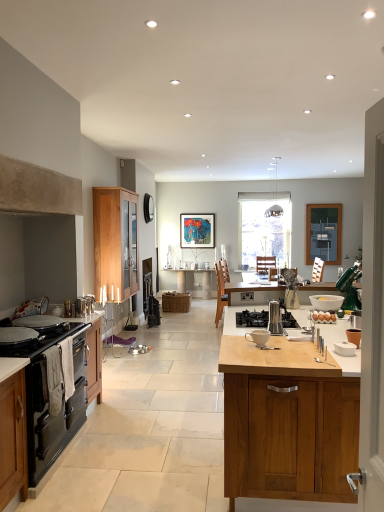
What do you see at coordinates (252, 319) in the screenshot? I see `stainless steel gas stove at center, the 1th gas stove viewed from the right` at bounding box center [252, 319].

This screenshot has height=512, width=384. What are the coordinates of `black matte stove at left` in the screenshot? It's located at (17, 335).

Locate an element on the screen. wooden cabinet at right, which is the first cabinetry from right to left is located at coordinates (287, 421).

Based on the photo, measure the distance between point (353, 295) and camera.

4.14 meters.

From the picture: What is the approximate width of black matte oven at left, which is the 1th appliance in left-to-right order?

It is 16.49 inches.

The image size is (384, 512). Identify the location of black plastic phone at upper center. [148, 208].

Would you consider wooden cabinet at right, which is the first cabinetry from right to left, to be distant from satin silver coffee maker at center, acting as the second appliance starting from the right?

That's right, there is a large distance between wooden cabinet at right, which is the first cabinetry from right to left, and satin silver coffee maker at center, acting as the second appliance starting from the right.

Which of these two, wooden cabinet at right, placed as the third cabinetry when sorted from left to right, or satin silver coffee maker at center, the first appliance in the back-to-front sequence, is bigger?

Bigger between the two is wooden cabinet at right, placed as the third cabinetry when sorted from left to right.

Which of these two, wooden cabinet at right, placed as the 1th cabinetry when sorted from front to back, or satin silver coffee maker at center, the first appliance in the back-to-front sequence, is thinner?

satin silver coffee maker at center, the first appliance in the back-to-front sequence, is thinner.

Who is shorter, wooden cabinet at right, the third cabinetry from the back, or satin silver coffee maker at center, the fifth appliance viewed from the left?

satin silver coffee maker at center, the fifth appliance viewed from the left, is shorter.

Between wooden cabinet at left, marked as the 2th cabinetry in a right-to-left arrangement, and satin nickel faucet at center, the 4th appliance from the right, which one is positioned behind?

wooden cabinet at left, marked as the 2th cabinetry in a right-to-left arrangement, is behind.

In the image, is wooden cabinet at left, acting as the second cabinetry starting from the left, on the left side or the right side of satin nickel faucet at center, the 4th appliance positioned from the front?

Based on their positions, wooden cabinet at left, acting as the second cabinetry starting from the left, is located to the left of satin nickel faucet at center, the 4th appliance positioned from the front.

Is wooden cabinet at left, marked as the 2th cabinetry in a right-to-left arrangement, beside satin nickel faucet at center, the 4th appliance positioned from the front?

No, wooden cabinet at left, marked as the 2th cabinetry in a right-to-left arrangement, is not making contact with satin nickel faucet at center, the 4th appliance positioned from the front.

Which object is thinner, wooden cabinet at left, which is counted as the 3th cabinetry, starting from the front, or satin nickel faucet at center, placed as the 3th appliance when sorted from left to right?

satin nickel faucet at center, placed as the 3th appliance when sorted from left to right.

The width and height of the screenshot is (384, 512). There is a stainless steel gas stove at center, the 2th gas stove from the left. In order to click on the 6th appliance above it (from the image's perspective) in this screenshot , I will do `click(290, 289)`.

Considering the positions of objects stainless steel gas stove at center, the 1th gas stove viewed from the right, and satin silver coffee maker at center, which is counted as the sixth appliance, starting from the front, in the image provided, who is behind, stainless steel gas stove at center, the 1th gas stove viewed from the right, or satin silver coffee maker at center, which is counted as the sixth appliance, starting from the front,?

Positioned behind is satin silver coffee maker at center, which is counted as the sixth appliance, starting from the front.

How far apart are stainless steel gas stove at center, the 1th gas stove viewed from the right, and satin silver coffee maker at center, the first appliance in the back-to-front sequence?

stainless steel gas stove at center, the 1th gas stove viewed from the right, and satin silver coffee maker at center, the first appliance in the back-to-front sequence, are 53.83 centimeters apart.

Can you confirm if stainless steel gas stove at center, the 2th gas stove from the left, is taller than satin silver coffee maker at center, the first appliance in the back-to-front sequence?

In fact, stainless steel gas stove at center, the 2th gas stove from the left, may be shorter than satin silver coffee maker at center, the first appliance in the back-to-front sequence.

Based on the photo, between white ceramic cup at center and green metallic stand mixer at right, which is the 2th appliance in back-to-front order, which one has larger size?

green metallic stand mixer at right, which is the 2th appliance in back-to-front order.

From a real-world perspective, is white ceramic cup at center positioned under green metallic stand mixer at right, which is the 2th appliance in back-to-front order, based on gravity?

Yes, from a real-world perspective, white ceramic cup at center is under green metallic stand mixer at right, which is the 2th appliance in back-to-front order.

Is white ceramic cup at center facing away from green metallic stand mixer at right, which is the 2th appliance in back-to-front order?

No, white ceramic cup at center is not facing the opposite direction of green metallic stand mixer at right, which is the 2th appliance in back-to-front order.

Are white ceramic cup at center and green metallic stand mixer at right, the first appliance viewed from the right, making contact?

They are not placed beside each other.

Does point (285, 325) come in front of point (88, 304)?

That is True.

From the picture: Which is more to the left, stainless steel gas stove at center, the 2th gas stove from the left, or satin nickel faucet at center, the 4th appliance positioned from the front?

From the viewer's perspective, satin nickel faucet at center, the 4th appliance positioned from the front, appears more on the left side.

Does stainless steel gas stove at center, the 2th gas stove from the left, have a larger size compared to satin nickel faucet at center, the 4th appliance from the right?

Indeed, stainless steel gas stove at center, the 2th gas stove from the left, has a larger size compared to satin nickel faucet at center, the 4th appliance from the right.

From the image's perspective, does stainless steel gas stove at center, the 2th gas stove from the left, appear lower than satin nickel faucet at center, the 4th appliance from the right?

Yes.

Considering the sizes of black matte stove at left and black plastic phone at upper center in the image, is black matte stove at left taller or shorter than black plastic phone at upper center?

Clearly, black matte stove at left is shorter compared to black plastic phone at upper center.

Based on the photo, between black matte stove at left and black plastic phone at upper center, which one has smaller width?

Thinner between the two is black plastic phone at upper center.

Considering the sizes of objects black matte stove at left and black plastic phone at upper center in the image provided, who is smaller, black matte stove at left or black plastic phone at upper center?

With smaller size is black matte stove at left.

Is black matte stove at left turned away from black plastic phone at upper center?

No, black plastic phone at upper center is not at the back of black matte stove at left.

Based on their sizes in the image, would you say wooden cabinet at right, the third cabinetry from the back, is bigger or smaller than stainless steel gas stove at center, the 1th gas stove viewed from the right?

Clearly, wooden cabinet at right, the third cabinetry from the back, is larger in size than stainless steel gas stove at center, the 1th gas stove viewed from the right.

From the image's perspective, count 2nd gas stoves upward from the wooden cabinet at right, placed as the third cabinetry when sorted from left to right, and point to it. Please provide its 2D coordinates.

[(252, 319)]

From the image's perspective, is wooden cabinet at right, placed as the third cabinetry when sorted from left to right, beneath stainless steel gas stove at center, the 2th gas stove from the left?

Yes.

Between wooden cabinet at right, placed as the 1th cabinetry when sorted from front to back, and stainless steel gas stove at center, the 1th gas stove viewed from the right, which one has more height?

Standing taller between the two is wooden cabinet at right, placed as the 1th cabinetry when sorted from front to back.

Locate an element on the screen. This screenshot has width=384, height=512. cabinetry that appears on the right of satin silver coffee maker at center, the fifth appliance viewed from the left is located at coordinates (287, 421).

Find the location of `cabinetry lying above the satin nickel faucet at center, the 4th appliance from the right (from the image's perspective)`. cabinetry lying above the satin nickel faucet at center, the 4th appliance from the right (from the image's perspective) is located at coordinates (115, 241).

Based on their spatial positions, is wooden cabinet at left, acting as the second cabinetry starting from the left, or black matte oven at left, which appears as the 2th cabinetry when viewed from the front, further from satin silver espresso maker at center, arranged as the first appliance when viewed from the front?

Based on the image, wooden cabinet at left, acting as the second cabinetry starting from the left, appears to be further to satin silver espresso maker at center, arranged as the first appliance when viewed from the front.

Looking at the image, which one is located further to black matte gas stove at left, which is the 1th gas stove in left-to-right order, black matte stove at left or woven brown picnic basket at center?

The object further to black matte gas stove at left, which is the 1th gas stove in left-to-right order, is woven brown picnic basket at center.

Based on their spatial positions, is wooden cabinet at right, placed as the third cabinetry when sorted from left to right, or satin silver coffee maker at center, the fifth appliance viewed from the left, closer to black plastic phone at upper center?

satin silver coffee maker at center, the fifth appliance viewed from the left, lies closer to black plastic phone at upper center than the other object.

Considering their positions, is satin silver coffee maker at center, acting as the second appliance starting from the right, positioned further to woven brown picnic basket at center than satin nickel faucet at center, which ranks as the third appliance in back-to-front order?

Among the two, satin nickel faucet at center, which ranks as the third appliance in back-to-front order, is located further to woven brown picnic basket at center.

When comparing their distances from black matte oven at left, which appears as the 2th cabinetry when viewed from the front, does black matte oven at left, which ranks as the fifth appliance in back-to-front order, or black plastic phone at upper center seem closer?

black matte oven at left, which ranks as the fifth appliance in back-to-front order, is closer to black matte oven at left, which appears as the 2th cabinetry when viewed from the front.

Based on their spatial positions, is satin silver coffee maker at center, the first appliance in the back-to-front sequence, or black matte oven at left, the first cabinetry positioned from the left, closer to green metallic stand mixer at right, the fifth appliance from the front?

satin silver coffee maker at center, the first appliance in the back-to-front sequence.

From the image, which object appears to be nearer to black matte oven at left, the sixth appliance positioned from the right, brown matte eggs at center or black matte oven at left, acting as the second cabinetry starting from the back?

black matte oven at left, acting as the second cabinetry starting from the back, is closer to black matte oven at left, the sixth appliance positioned from the right.

Considering their positions, is green metallic stand mixer at right, the first appliance viewed from the right, positioned further to metallic silver kettle at left, which is the second appliance in left-to-right order, than satin silver coffee maker at center, the fifth appliance viewed from the left?

The object further to metallic silver kettle at left, which is the second appliance in left-to-right order, is green metallic stand mixer at right, the first appliance viewed from the right.

Locate an element on the screen. Image resolution: width=384 pixels, height=512 pixels. food between wooden cabinet at right, placed as the 1th cabinetry when sorted from front to back, and black plastic phone at upper center, along the z-axis is located at coordinates (323, 317).

Where is `food between stainless steel gas stove at center, the 1th gas stove viewed from the right, and satin silver coffee maker at center, which is counted as the sixth appliance, starting from the front, in the front-back direction`? Image resolution: width=384 pixels, height=512 pixels. food between stainless steel gas stove at center, the 1th gas stove viewed from the right, and satin silver coffee maker at center, which is counted as the sixth appliance, starting from the front, in the front-back direction is located at coordinates (323, 317).

The image size is (384, 512). Identify the location of coffee cup located between satin nickel faucet at center, which ranks as the third appliance in back-to-front order, and satin silver coffee maker at center, the fifth appliance viewed from the left, in the left-right direction. (258, 337).

What are the coordinates of `kitchen appliance between black matte oven at left, acting as the second cabinetry starting from the back, and wooden cabinet at right, placed as the 1th cabinetry when sorted from front to back, in the horizontal direction` in the screenshot? It's located at (17, 335).